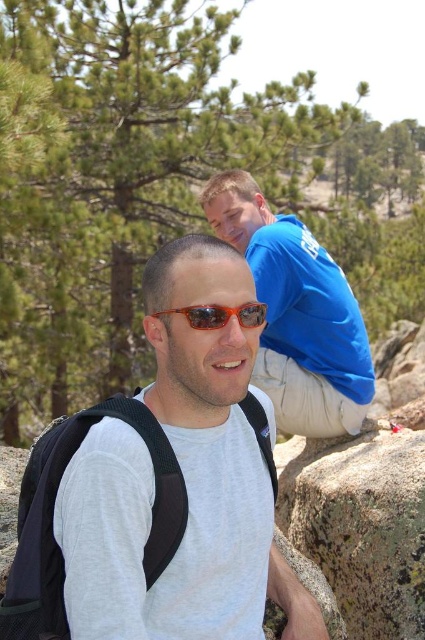
You are a hiker trying to navigate through the dense forest. You see a green textured pine tree at upper center. Can you determine its position relative to the center of the image?

Result: The green textured pine tree at upper center is located at point 0.286 along the horizontal axis and 0.384 along the vertical axis relative to the center of the image.